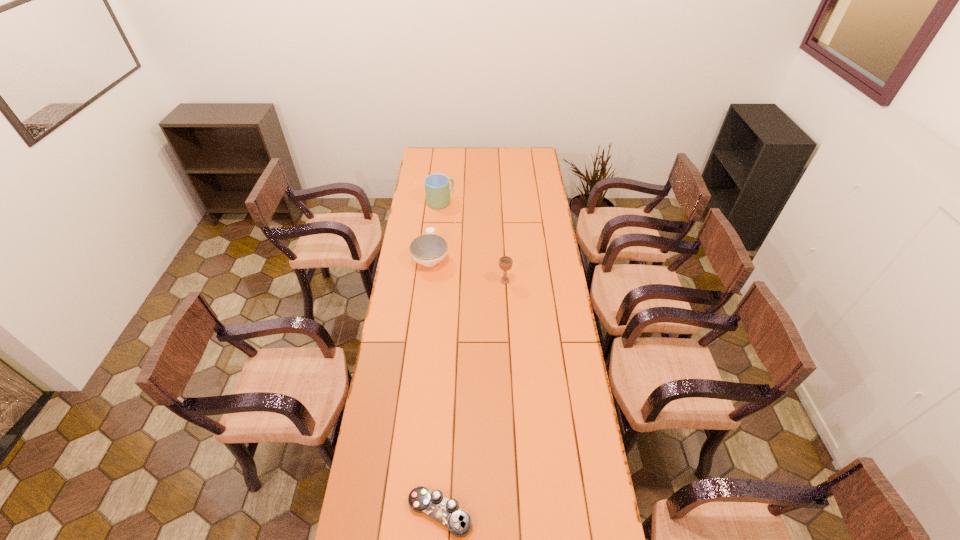
In order to click on unoccupied area between the shortest object and the farthest object in this screenshot , I will do `click(441, 357)`.

You are a GUI agent. You are given a task and a screenshot of the screen. Output one action in this format:
    pyautogui.click(x=<x>, y=<y>)
    Task: Click on the vacant point located between the nearest object and the farthest object
    
    Given the screenshot: What is the action you would take?
    pyautogui.click(x=441, y=357)

Where is `empty space between the third nearest object and the chalice`? The height and width of the screenshot is (540, 960). empty space between the third nearest object and the chalice is located at coordinates (468, 269).

The height and width of the screenshot is (540, 960). What are the coordinates of `vacant space in between the chalice and the control` in the screenshot? It's located at (472, 397).

Image resolution: width=960 pixels, height=540 pixels. Find the location of `vacant area that lies between the chinaware and the farthest object`. vacant area that lies between the chinaware and the farthest object is located at coordinates (436, 230).

Identify the location of free space between the chinaware and the mug. (436, 230).

Locate an element on the screen. The height and width of the screenshot is (540, 960). empty space that is in between the chalice and the farthest object is located at coordinates (472, 241).

This screenshot has height=540, width=960. I want to click on free space between the second farthest object and the rightmost object, so click(x=468, y=269).

Where is `blank region between the control and the chalice`? This screenshot has width=960, height=540. blank region between the control and the chalice is located at coordinates 472,397.

At what (x,y) coordinates should I click in order to perform the action: click on vacant space that's between the control and the chalice. Please return your answer as a coordinate pair (x, y). Looking at the image, I should click on (472, 397).